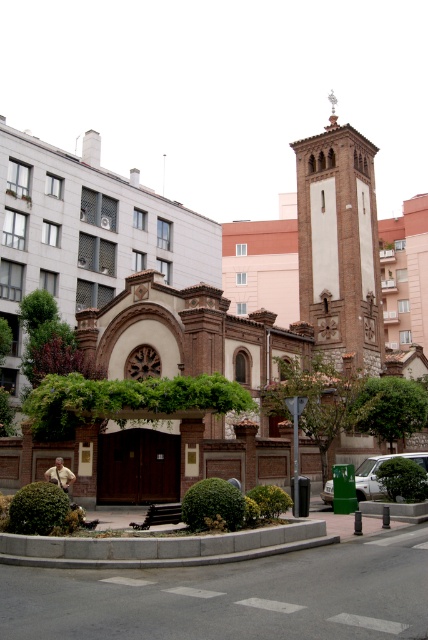
Consider the image. Can you confirm if brown brick church at center is taller than green matte car at lower right?

Yes.

Can you confirm if brown brick church at center is shorter than green matte car at lower right?

In fact, brown brick church at center may be taller than green matte car at lower right.

Who is more forward, (201, 368) or (374, 454)?

Point (201, 368) is more forward.

The width and height of the screenshot is (428, 640). I want to click on brown brick church at center, so click(x=267, y=276).

Between point (359, 308) and point (366, 484), which one is positioned behind?

The point (359, 308) is more distant.

Does point (332, 144) lie behind point (422, 465)?

That is True.

Identify the location of brick tower at upper right. Image resolution: width=428 pixels, height=640 pixels. (339, 244).

Who is more distant from viewer, [98,150] or [323,324]?

Point [98,150]

Is brown brick church at center in front of brick tower at upper right?

Yes, it is.

Is point (425, 225) less distant than point (314, 147)?

No.

The height and width of the screenshot is (640, 428). I want to click on brown brick church at center, so click(x=267, y=276).